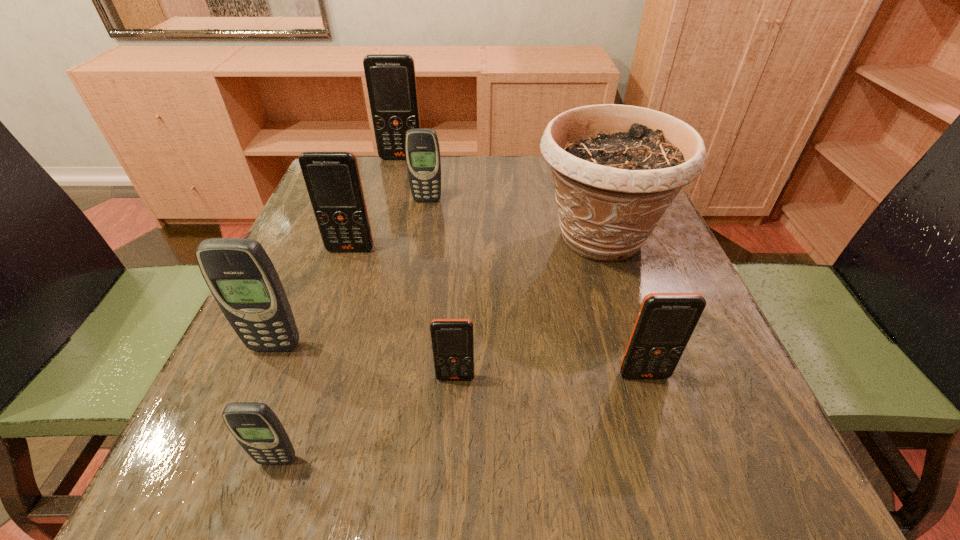
The height and width of the screenshot is (540, 960). Identify the location of blank area in the image that satisfies the following two spatial constraints: 1. on the screen of the sixth nearest cellular telephone; 2. on the right side of the flowerpot. (421, 238).